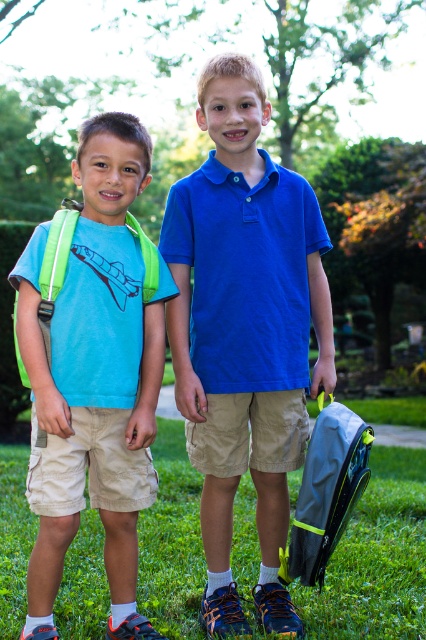
Question: Does blue cotton polo shirt at center appear over matte green backpack at left?

Choices:
 (A) yes
 (B) no

Answer: (A)

Question: Which object is closer to the camera taking this photo?

Choices:
 (A) green grass at lower center
 (B) matte green backpack at left
 (C) blue cotton polo shirt at center

Answer: (B)

Question: Is blue cotton polo shirt at center behind matte green backpack at left?

Choices:
 (A) no
 (B) yes

Answer: (B)

Question: Is blue cotton polo shirt at center to the left of green grass at lower center from the viewer's perspective?

Choices:
 (A) yes
 (B) no

Answer: (A)

Question: Which point is closer to the camera taking this photo?

Choices:
 (A) (85, 355)
 (B) (367, 636)

Answer: (A)

Question: Which of these objects is positioned closest to the green grass at lower center?

Choices:
 (A) matte green backpack at left
 (B) blue cotton polo shirt at center

Answer: (B)